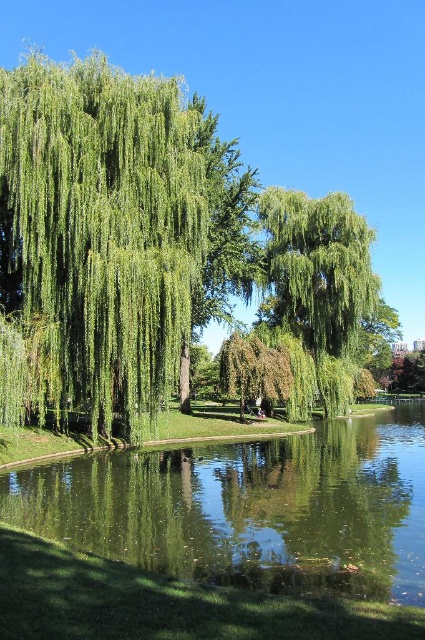
Is green leafy willow at left positioned behind green reflective water at center?

Yes, green leafy willow at left is further from the viewer.

This screenshot has width=425, height=640. Identify the location of green leafy willow at left. (104, 225).

Where is `green leafy willow at left`? The image size is (425, 640). green leafy willow at left is located at coordinates (104, 225).

Can you confirm if green leafy willow at left is positioned above green leafy willow at center?

Yes.

Based on the photo, does green leafy willow at left lie behind green leafy willow at center?

No.

Does point (152, 364) come behind point (373, 285)?

No.

Image resolution: width=425 pixels, height=640 pixels. In order to click on green leafy willow at left in this screenshot , I will do `click(104, 225)`.

Who is shorter, green reflective water at center or green leafy willow at center?

Standing shorter between the two is green reflective water at center.

Does green reflective water at center appear on the left side of green leafy willow at center?

Yes, green reflective water at center is to the left of green leafy willow at center.

Measure the distance between point (280, 538) and camera.

The distance of point (280, 538) from camera is 10.67 meters.

Identify the location of green reflective water at center. Image resolution: width=425 pixels, height=640 pixels. (249, 508).